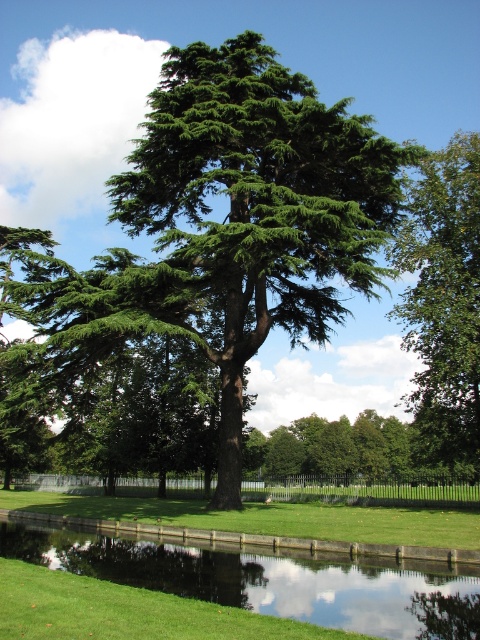
In the scene shown: Between green needle-like leaves at center and green grass at lower center, which one appears on the right side from the viewer's perspective?

green grass at lower center

Who is shorter, green needle-like leaves at center or green grass at lower center?

With less height is green grass at lower center.

At what (x,y) coordinates should I click in order to perform the action: click on green needle-like leaves at center. Please return your answer as a coordinate pair (x, y). Looking at the image, I should click on (228, 227).

Locate an element on the screen. green needle-like leaves at center is located at coordinates (228, 227).

Can you confirm if green grass at lower center is positioned below green leafy tree at upper right?

Yes.

Between green grass at lower center and green leafy tree at upper right, which one is positioned higher?

green leafy tree at upper right

What do you see at coordinates (271, 577) in the screenshot? I see `green grass at lower center` at bounding box center [271, 577].

I want to click on green grass at lower center, so click(271, 577).

Find the location of `green needle-like leaves at center`. green needle-like leaves at center is located at coordinates (228, 227).

Which is more to the right, green needle-like leaves at center or green leafy tree at upper right?

green leafy tree at upper right is more to the right.

Between point (385, 234) and point (430, 307), which one is positioned behind?

The point (430, 307) is behind.

Image resolution: width=480 pixels, height=640 pixels. Identify the location of green needle-like leaves at center. (228, 227).